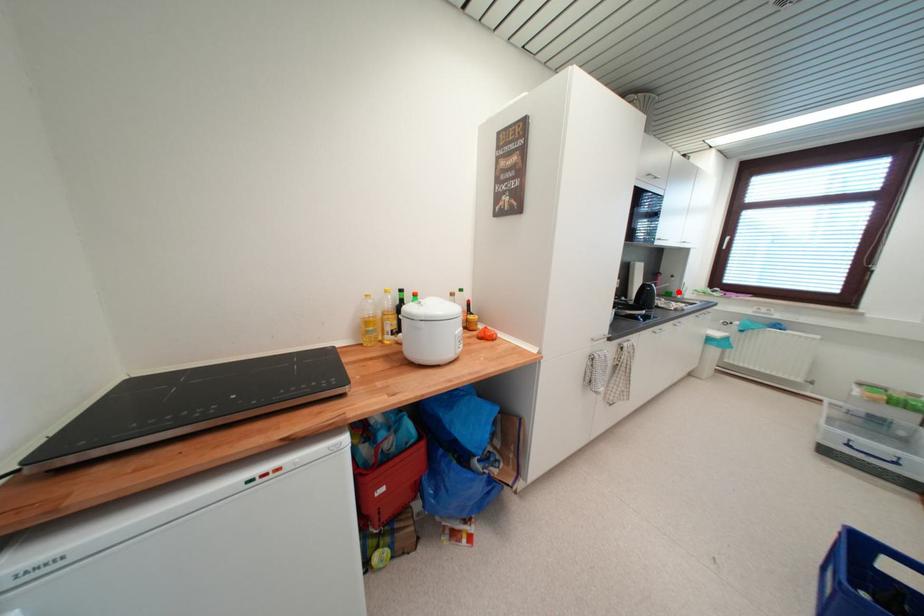
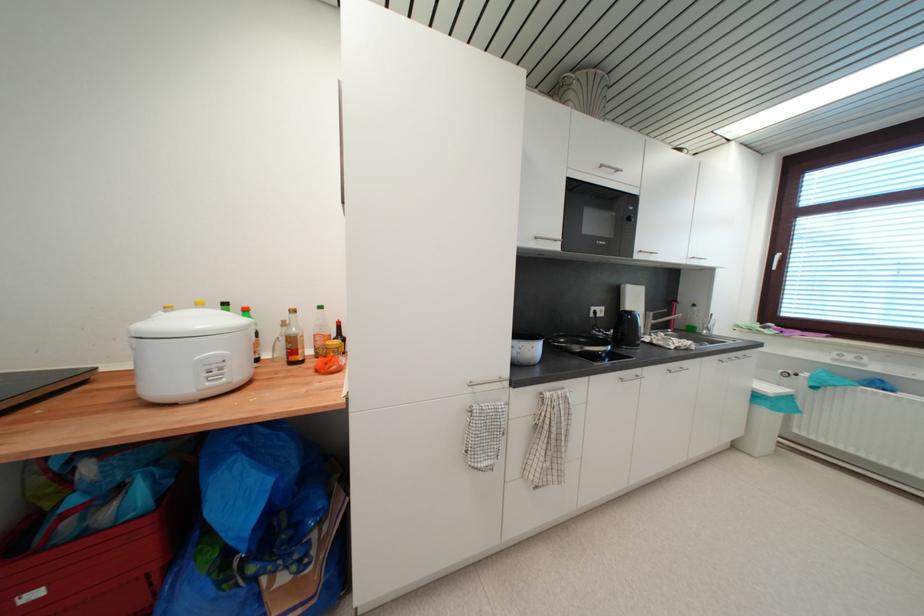
Question: I am providing you with two images of the same scene from different viewpoints. Image1 has a red point marked. In image2, the corresponding 3D location appears at what relative position? Reply with the corresponding letter.

Choices:
 (A) Closer
 (B) Farther

Answer: (A)